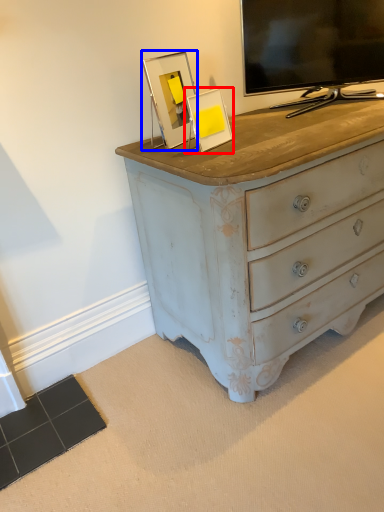
Question: Which point is further to the camera, picture frame (highlighted by a red box) or picture frame (highlighted by a blue box)?

Choices:
 (A) picture frame
 (B) picture frame

Answer: (B)